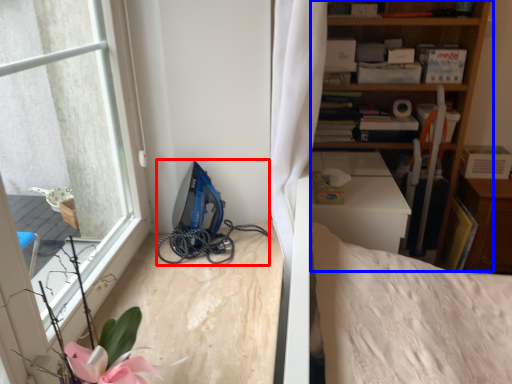
Question: Which object is closer to the camera taking this photo, equipment (highlighted by a red box) or shelf (highlighted by a blue box)?

Choices:
 (A) equipment
 (B) shelf

Answer: (A)